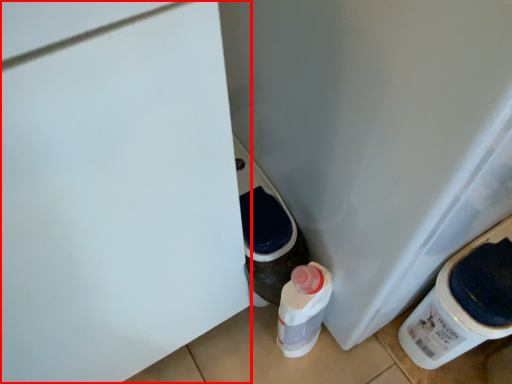
Question: Considering the relative positions of door (annotated by the red box) and water cooler in the image provided, where is door (annotated by the red box) located with respect to the staircase?

Choices:
 (A) left
 (B) right

Answer: (A)